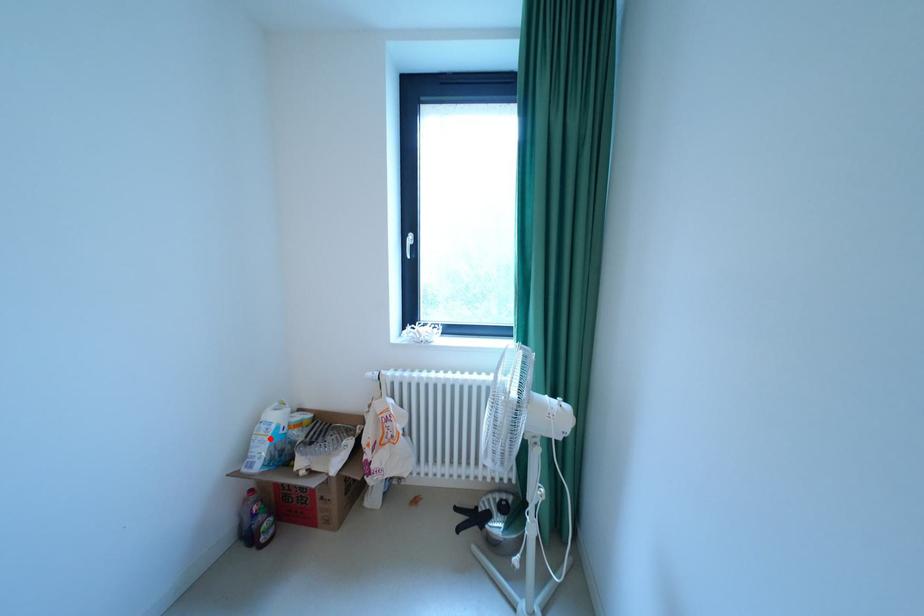
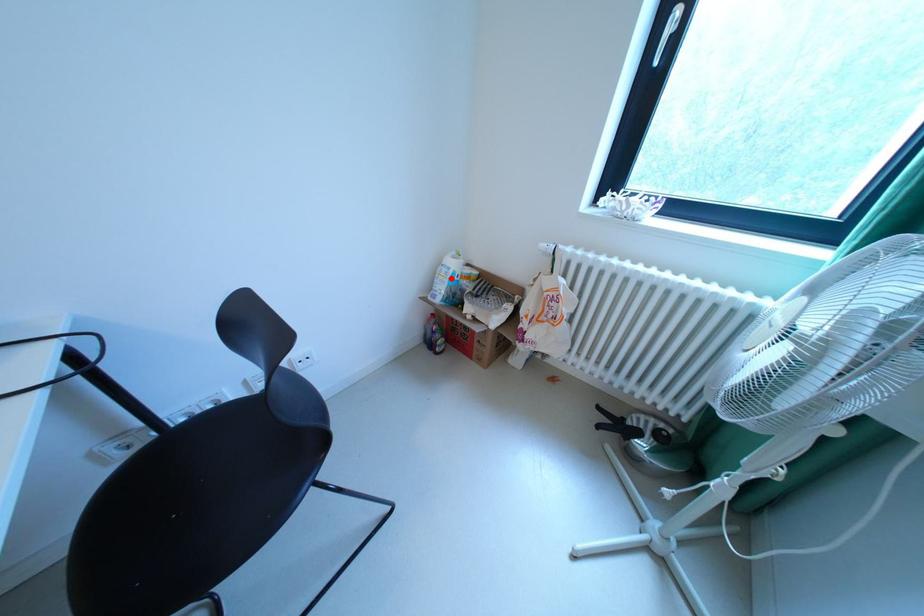
I am providing you with two images of the same scene from different viewpoints. A red point is marked on the first image and another point is marked on the second image. Is the marked point in image1 the same physical position as the marked point in image2?

Yes